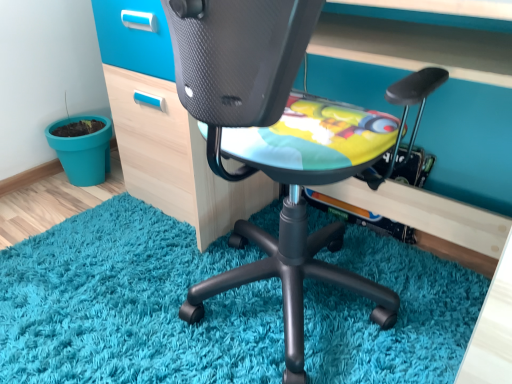
Question: Would you say matte black chair at center is to the left or to the right of teal plastic flowerpot at lower left in the picture?

Choices:
 (A) left
 (B) right

Answer: (B)

Question: From a real-world perspective, is matte black chair at center positioned above or below teal plastic flowerpot at lower left?

Choices:
 (A) above
 (B) below

Answer: (A)

Question: Does point (287, 365) appear closer or farther from the camera than point (66, 148)?

Choices:
 (A) closer
 (B) farther

Answer: (A)

Question: Is point coord(97,114) closer or farther from the camera than point coord(294,324)?

Choices:
 (A) closer
 (B) farther

Answer: (B)

Question: In terms of height, does teal plastic flowerpot at lower left look taller or shorter compared to matte black chair at center?

Choices:
 (A) tall
 (B) short

Answer: (B)

Question: Considering the positions of teal plastic flowerpot at lower left and matte black chair at center in the image, is teal plastic flowerpot at lower left wider or thinner than matte black chair at center?

Choices:
 (A) thin
 (B) wide

Answer: (A)

Question: From the image's perspective, is teal plastic flowerpot at lower left positioned above or below matte black chair at center?

Choices:
 (A) below
 (B) above

Answer: (B)